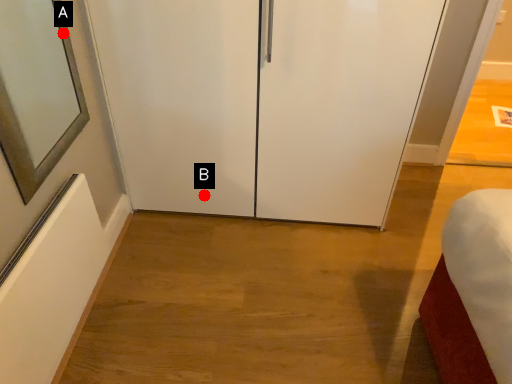
Question: Two points are circled on the image, labeled by A and B beside each circle. Among these points, which one is farthest from the camera?

Choices:
 (A) A is further
 (B) B is further

Answer: (B)